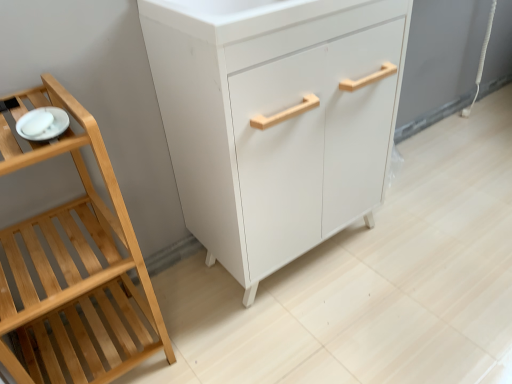
I want to click on free spot in front of white matte cabinet at center, so click(326, 334).